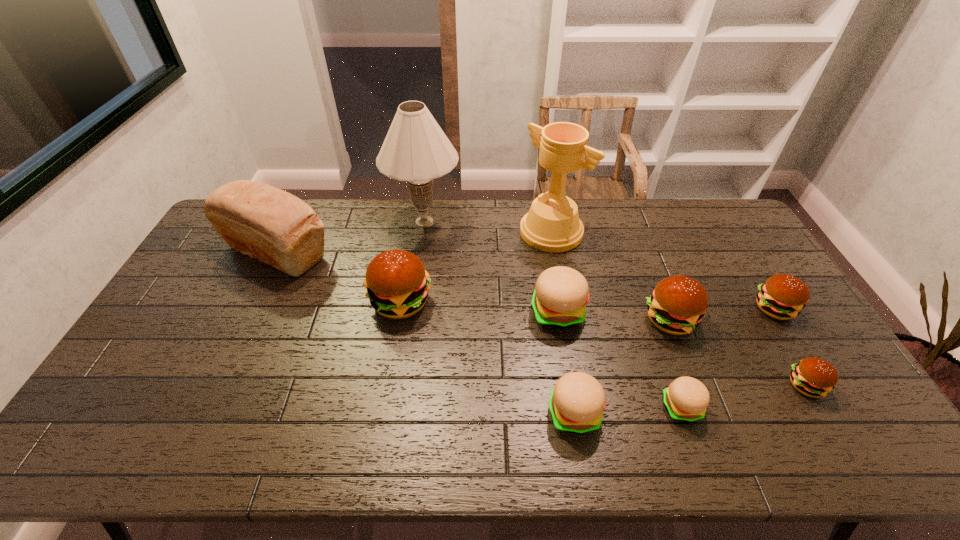
Find the location of a particular element. The image size is (960, 540). lampshade is located at coordinates (416, 150).

In order to click on beige award in this screenshot , I will do `click(552, 224)`.

The image size is (960, 540). Find the location of `the third tallest object`. the third tallest object is located at coordinates (261, 221).

At what (x,y) coordinates should I click in order to perform the action: click on bread. Please return your answer as a coordinate pair (x, y). This screenshot has width=960, height=540. Looking at the image, I should click on (261, 221).

I want to click on the biggest brown hamburger, so click(x=397, y=285).

This screenshot has width=960, height=540. I want to click on the leftmost brown hamburger, so click(x=397, y=285).

This screenshot has height=540, width=960. What are the coordinates of `the second brown hamburger from left to right` in the screenshot? It's located at (677, 305).

Find the location of a particular element. The image size is (960, 540). the biggest beige hamburger is located at coordinates (559, 300).

What are the coordinates of `the third biggest brown hamburger` in the screenshot? It's located at (783, 296).

You are a GUI agent. You are given a task and a screenshot of the screen. Output one action in this format:
    pyautogui.click(x=<x>, y=<y>)
    Task: Click on the second biggest beige hamburger
    Image resolution: width=960 pixels, height=540 pixels.
    Given the screenshot: What is the action you would take?
    pyautogui.click(x=577, y=401)